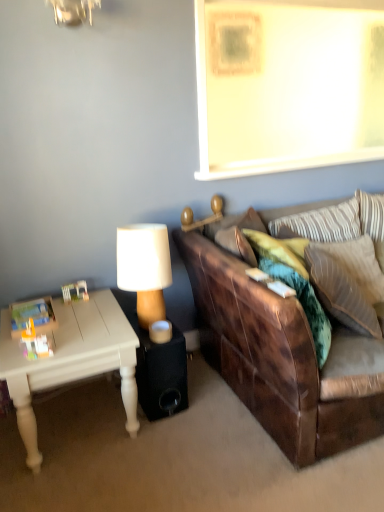
Question: Which direction should I rotate to look at velvet green pillow at center, acting as the first pillow starting from the front?

Choices:
 (A) right
 (B) left

Answer: (A)

Question: Could you tell me if wooden lampshade at upper center, positioned as the second lamp in left-to-right order, is facing wooden lampshade at center, which is the 2th lamp from top to bottom?

Choices:
 (A) yes
 (B) no

Answer: (B)

Question: Is wooden lampshade at upper center, the first lamp when ordered from top to bottom, facing away from wooden lampshade at center, arranged as the 1th lamp when ordered from the bottom?

Choices:
 (A) no
 (B) yes

Answer: (A)

Question: From the image's perspective, is wooden lampshade at upper center, positioned as the second lamp in left-to-right order, under wooden lampshade at center, which is the 2th lamp from top to bottom?

Choices:
 (A) no
 (B) yes

Answer: (A)

Question: Does wooden lampshade at upper center, the 2th lamp in the bottom-to-top sequence, appear on the right side of wooden lampshade at center, which is the 2th lamp from top to bottom?

Choices:
 (A) yes
 (B) no

Answer: (A)

Question: Does wooden lampshade at upper center, the 2th lamp in the bottom-to-top sequence, have a smaller size compared to wooden lampshade at center, which is the 2th lamp from top to bottom?

Choices:
 (A) no
 (B) yes

Answer: (B)

Question: Does wooden lampshade at upper center, positioned as the second lamp in left-to-right order, have a lesser height compared to wooden lampshade at center, the first lamp from the left?

Choices:
 (A) no
 (B) yes

Answer: (B)

Question: Is velvet green pillow at right, the second pillow from the back, at the left side of velvet green pillow at center, the third pillow from the back?

Choices:
 (A) yes
 (B) no

Answer: (B)

Question: Considering the relative positions of velvet green pillow at right, positioned as the second pillow in front-to-back order, and velvet green pillow at center, acting as the first pillow starting from the front, in the image provided, is velvet green pillow at right, positioned as the second pillow in front-to-back order, behind velvet green pillow at center, acting as the first pillow starting from the front,?

Choices:
 (A) yes
 (B) no

Answer: (A)

Question: Is the depth of velvet green pillow at right, the second pillow from the back, less than that of velvet green pillow at center, acting as the first pillow starting from the front?

Choices:
 (A) yes
 (B) no

Answer: (B)

Question: Is the surface of velvet green pillow at right, positioned as the second pillow in front-to-back order, in direct contact with velvet green pillow at center, acting as the first pillow starting from the front?

Choices:
 (A) no
 (B) yes

Answer: (A)

Question: From the image's perspective, is velvet green pillow at right, the second pillow from the back, located above velvet green pillow at center, the third pillow from the back?

Choices:
 (A) no
 (B) yes

Answer: (B)

Question: Can you confirm if velvet green pillow at right, the second pillow from the back, is taller than velvet green pillow at center, the third pillow from the back?

Choices:
 (A) yes
 (B) no

Answer: (B)

Question: Is striped fabric pillow at upper right, the 3th pillow in the front-to-back sequence, positioned behind velvet green pillow at right, the second pillow from the back?

Choices:
 (A) no
 (B) yes

Answer: (B)